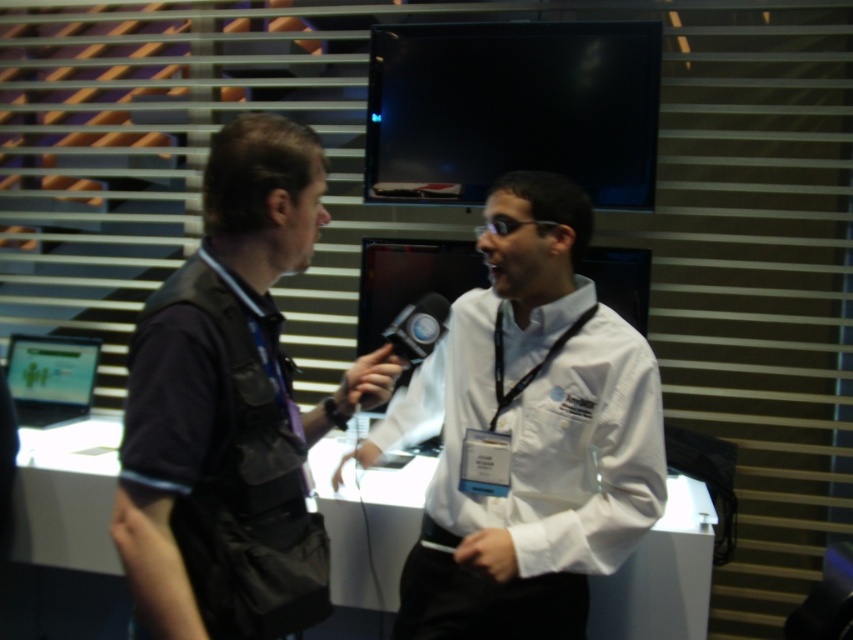
Question: Does white glossy shirt at center have a lesser width compared to black fabric vest at left?

Choices:
 (A) no
 (B) yes

Answer: (A)

Question: Among these points, which one is nearest to the camera?

Choices:
 (A) (561, 193)
 (B) (271, 378)

Answer: (B)

Question: Does white glossy shirt at center come behind black fabric vest at left?

Choices:
 (A) yes
 (B) no

Answer: (A)

Question: Which of the following is the farthest from the observer?

Choices:
 (A) white glossy shirt at center
 (B) black fabric vest at left

Answer: (A)

Question: Considering the relative positions of white glossy shirt at center and black fabric vest at left in the image provided, where is white glossy shirt at center located with respect to black fabric vest at left?

Choices:
 (A) right
 (B) left

Answer: (A)